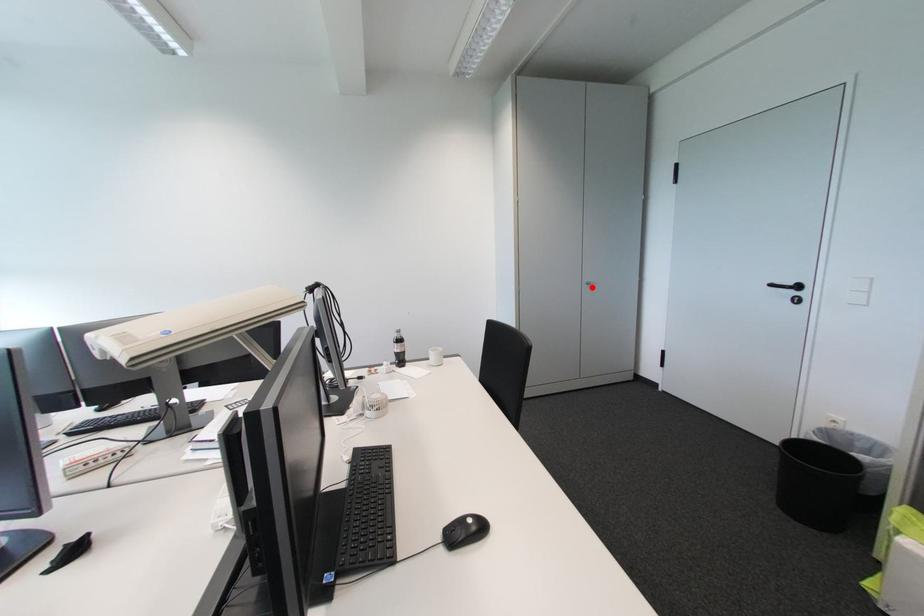
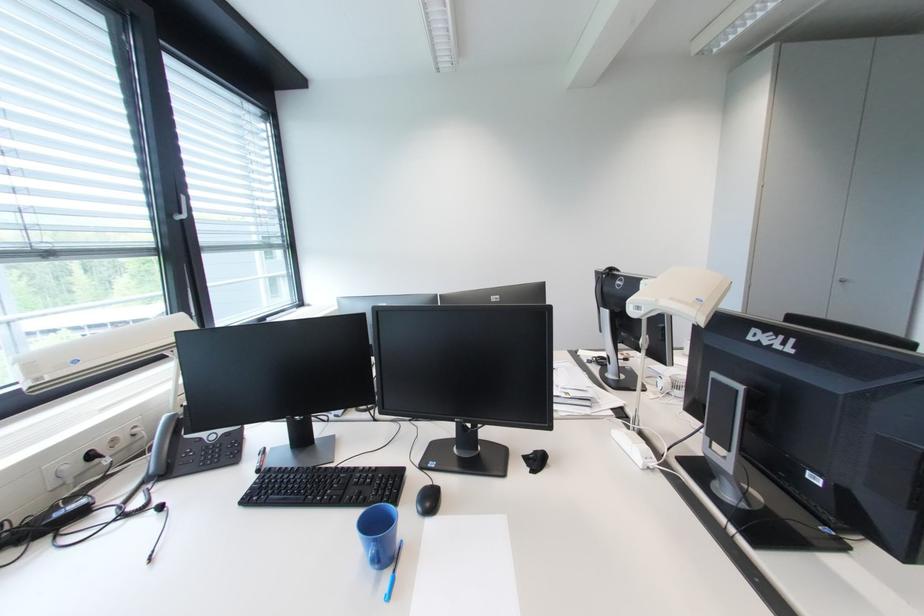
Where in the second image is the point corresponding to the highlighted location from the first image?

(844, 285)